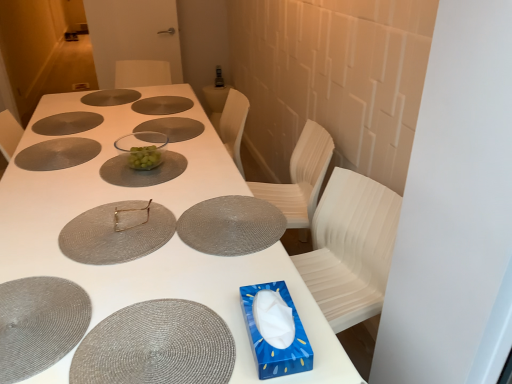
You are a GUI agent. You are given a task and a screenshot of the screen. Output one action in this format:
    pyautogui.click(x=<x>, y=<y>)
    Task: Click on the vacant space underneath matte gray placemat at center, arranged as the second glass plate when viewed from the front (from a real-world perspective)
    This screenshot has height=384, width=512.
    Given the screenshot: What is the action you would take?
    pyautogui.click(x=121, y=228)